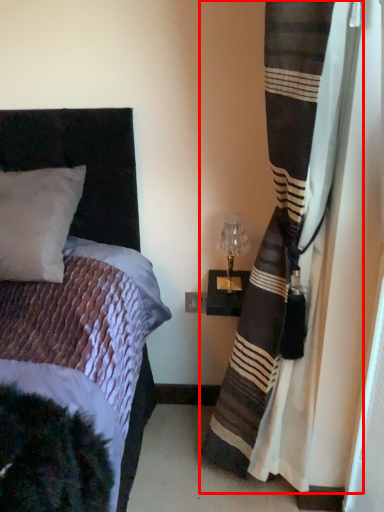
Question: From the image's perspective, considering the relative positions of curtain (annotated by the red box) and table lamp in the image provided, where is curtain (annotated by the red box) located with respect to the staircase?

Choices:
 (A) above
 (B) below

Answer: (B)